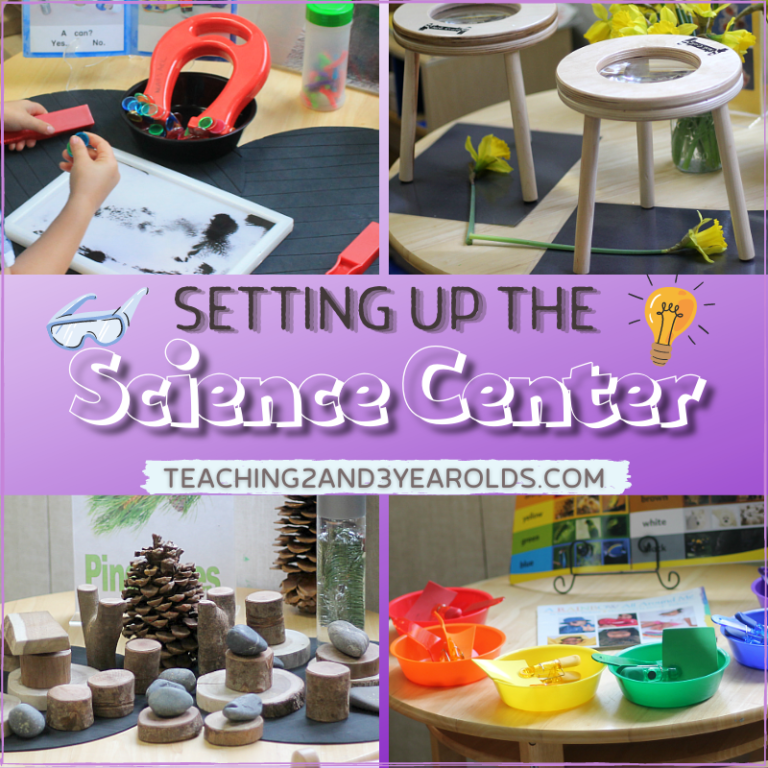
What are the coordinates of `mat` in the screenshot? It's located at (299, 190).